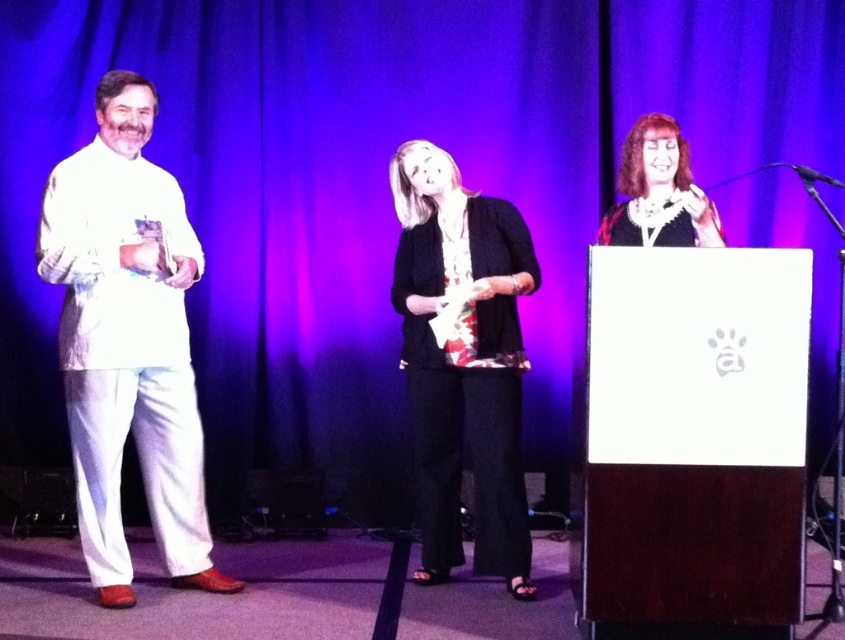
You are standing at the point marked as point [96,385] during a formal event on stage. The stage has a purple backdrop. You need to hand over an award to someone located 11.14 feet away from you. Can you reach them directly without moving? Please explain your reasoning.

The point [96,385] and viewer are 11.14 feet apart. Since the distance is 11.14 feet, which is quite far, you cannot reach them directly without moving closer.

You are a photographer at the event and need to capture a photo where both the white satin suit at left and the matte black dress at center are clearly visible. Based on their positions, which one should you focus on first to ensure proper exposure?

The white satin suit at left is positioned under the matte black dress at center, so focusing on the matte black dress at center first will ensure it is properly exposed before adjusting for the white satin suit at left.